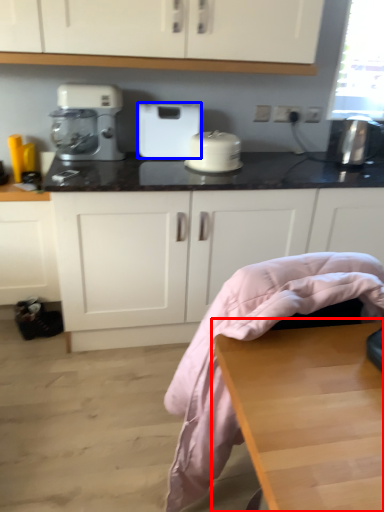
Question: Which point is further to the camera, table (highlighted by a red box) or home appliance (highlighted by a blue box)?

Choices:
 (A) table
 (B) home appliance

Answer: (B)